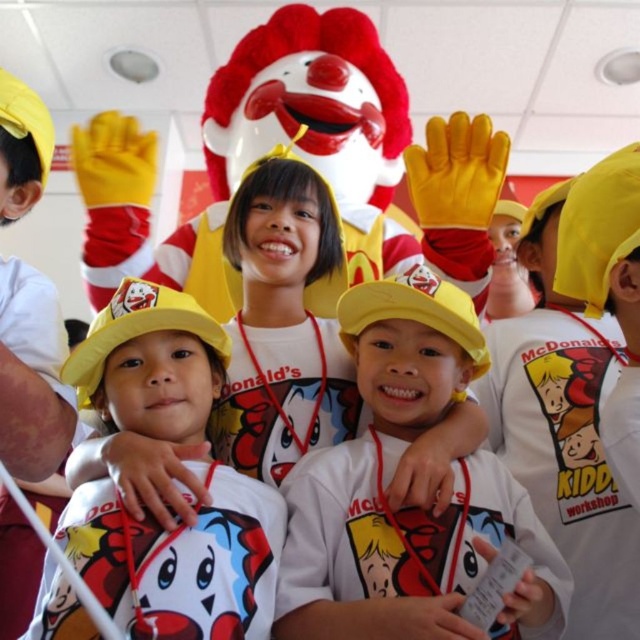
Question: Which point is closer to the camera?

Choices:
 (A) yellow matte cap at center
 (B) yellow matte hat at center

Answer: (B)

Question: Does yellow matte cap at center appear on the left side of yellow matte hat at center?

Choices:
 (A) yes
 (B) no

Answer: (B)

Question: Is yellow matte cap at center further to camera compared to yellow matte hat at center?

Choices:
 (A) yes
 (B) no

Answer: (A)

Question: Is yellow matte cap at center in front of yellow matte hat at center?

Choices:
 (A) yes
 (B) no

Answer: (B)